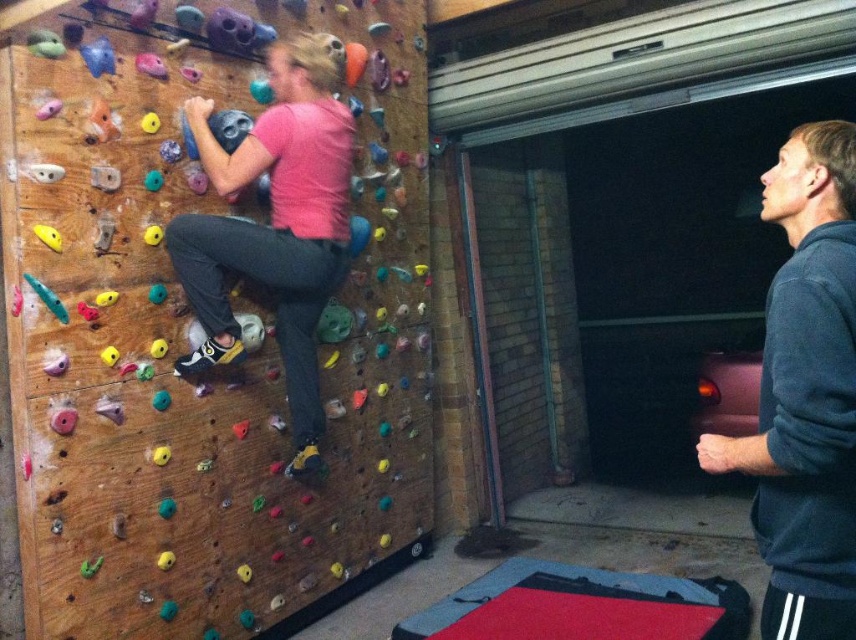
From the picture: You are a climber trying to reach the top of the wall. You see two points on the climbing wall labeled as point [94,321] and point [810,209]. Which point is closer to you?

Point [94,321] is further to the camera than point [810,209], so the point closer to you is point [810,209].

You are an observer standing in front of the climbing wall. You notice the wooden climbing wall at left and the pink matte shirt at center. Which object occupies more horizontal space in the image?

The wooden climbing wall at left occupies more horizontal space than the pink matte shirt at center because its width is larger than the shirt.